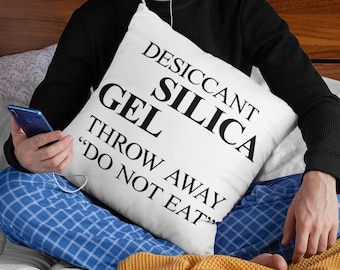
You are a GUI agent. You are given a task and a screenshot of the screen. Output one action in this format:
    pyautogui.click(x=<x>, y=<y>)
    Task: Click on the yellow blanket
    The image size is (340, 270).
    Given the screenshot: What is the action you would take?
    pyautogui.click(x=142, y=263)